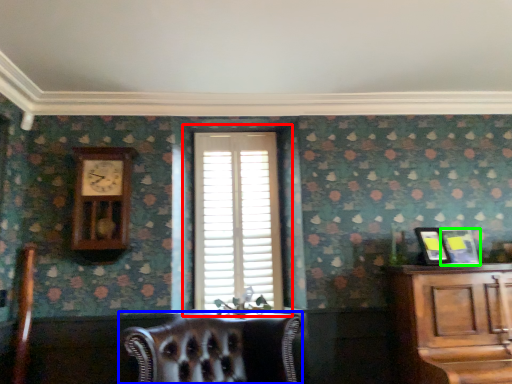
Question: Considering the real-world distances, which object is farthest from window (highlighted by a red box)? chair (highlighted by a blue box) or picture frame (highlighted by a green box)?

Choices:
 (A) chair
 (B) picture frame

Answer: (B)